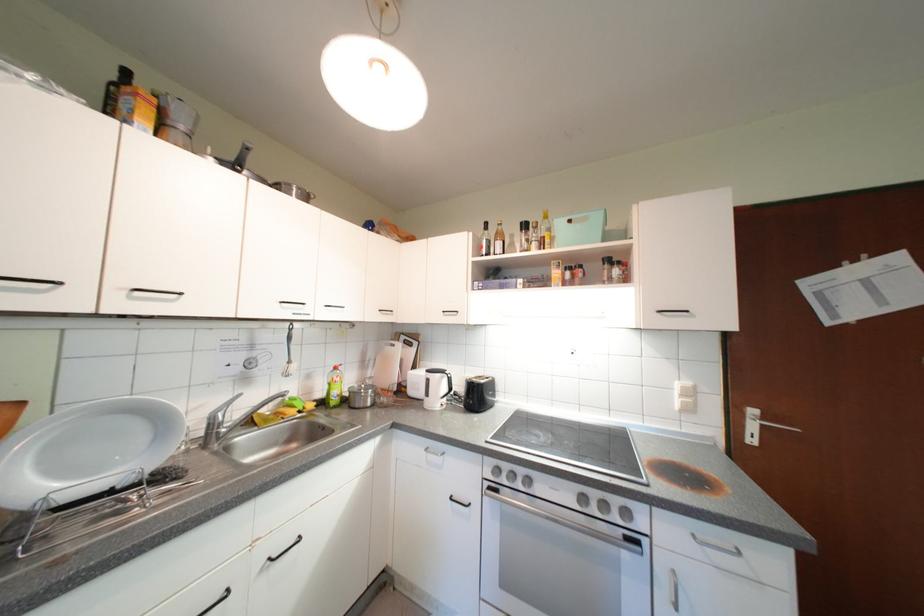
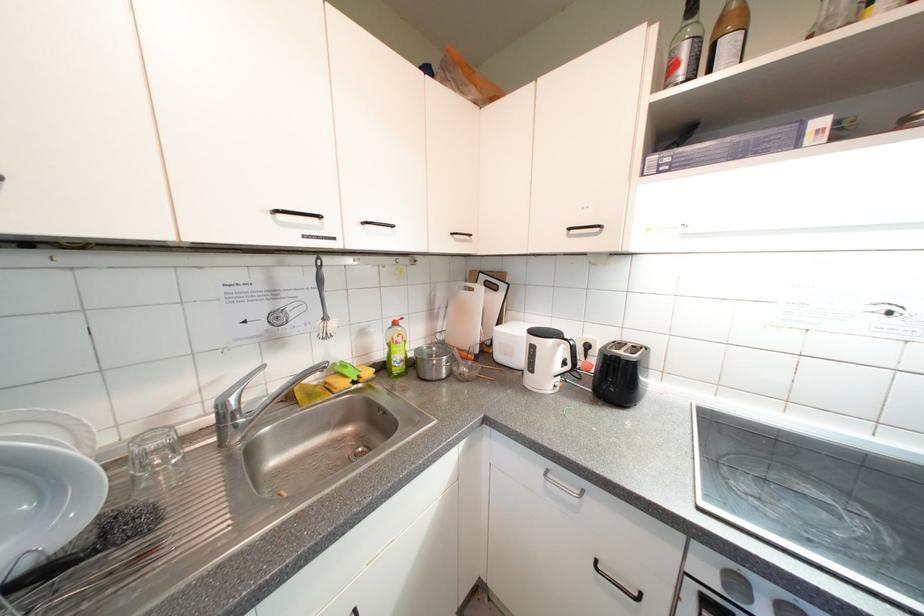
The point at (297,363) is marked in the first image. Where is the corresponding point in the second image?

(333, 321)